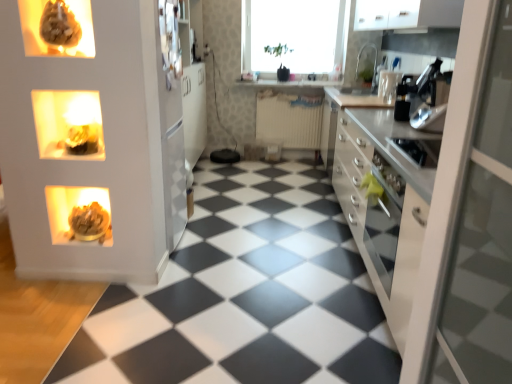
How much space does black plastic coffee maker at upper right, acting as the 3th appliance starting from the top, occupy vertically?

black plastic coffee maker at upper right, acting as the 3th appliance starting from the top, is 41.54 centimeters tall.

The image size is (512, 384). Describe the element at coordinates (245, 294) in the screenshot. I see `black rubber tile at center` at that location.

What is the approximate height of black rubber tile at center?

1.57 inches.

What is the approximate height of satin white countertop at right?

satin white countertop at right is 34.08 inches tall.

Locate an element on the screen. This screenshot has height=384, width=512. matte gold sculpture at left, the 3th appliance positioned from the back is located at coordinates (79, 215).

In order to click on matte gold candle at upper left in this screenshot , I will do `click(68, 124)`.

I want to click on matte brown sculpture at upper left, placed as the 1th appliance when sorted from front to back, so click(x=57, y=28).

You are a GUI agent. You are given a task and a screenshot of the screen. Output one action in this format:
    pyautogui.click(x=<x>, y=<y>)
    Task: Click on the clear glass cup at upper right, the 1th appliance in the right-to-left sequence
    The image size is (512, 384).
    Given the screenshot: What is the action you would take?
    pyautogui.click(x=388, y=86)

Identify the location of black plastic coffee maker at upper right, the 2th appliance when ordered from back to front. The width and height of the screenshot is (512, 384). tap(414, 89).

Can you see matte gold candle at upper left touching white matte cabinet at upper right?

No, matte gold candle at upper left is not touching white matte cabinet at upper right.

Is matte gold candle at upper left looking in the opposite direction of white matte cabinet at upper right?

No.

Does matte gold candle at upper left contain white matte cabinet at upper right?

No.

Between point (384, 20) and point (120, 286), which one is positioned in front?

The point (120, 286) is closer to the camera.

Considering the relative sizes of white matte cabinet at upper right and black rubber tile at center in the image provided, is white matte cabinet at upper right wider than black rubber tile at center?

No, white matte cabinet at upper right is not wider than black rubber tile at center.

At what (x,y) coordinates should I click in order to perform the action: click on tile beneath the white matte cabinet at upper right (from a real-world perspective). Please return your answer as a coordinate pair (x, y). This screenshot has width=512, height=384. Looking at the image, I should click on (245, 294).

Who is bigger, white matte cabinet at upper right or black rubber tile at center?

Bigger between the two is black rubber tile at center.

Is black rubber tile at center closer to camera compared to black plastic coffee maker at upper right, positioned as the 3th appliance in left-to-right order?

That is True.

How far apart are black rubber tile at center and black plastic coffee maker at upper right, acting as the 3th appliance starting from the top?

They are 4.47 feet apart.

Which of these two, black rubber tile at center or black plastic coffee maker at upper right, which is counted as the 2th appliance, starting from the bottom, is bigger?

Bigger between the two is black rubber tile at center.

Can you tell me how much white glossy countertop at center and matte brown sculpture at upper left, acting as the second appliance starting from the left, differ in facing direction?

0.0676 degrees.

Which is correct: white glossy countertop at center is inside matte brown sculpture at upper left, placed as the 4th appliance when sorted from back to front, or outside of it?

white glossy countertop at center is outside matte brown sculpture at upper left, placed as the 4th appliance when sorted from back to front.

Considering the relative sizes of white glossy countertop at center and matte brown sculpture at upper left, acting as the second appliance starting from the left, in the image provided, is white glossy countertop at center smaller than matte brown sculpture at upper left, acting as the second appliance starting from the left,?

Actually, white glossy countertop at center might be larger than matte brown sculpture at upper left, acting as the second appliance starting from the left.

From a real-world perspective, is matte gold candle at upper left positioned above or below white glossy countertop at center?

matte gold candle at upper left is situated higher than white glossy countertop at center in the real world.

Can you see matte gold candle at upper left touching white glossy countertop at center?

There is a gap between matte gold candle at upper left and white glossy countertop at center.

Consider the image. From the image's perspective, is matte gold candle at upper left above white glossy countertop at center?

Actually, matte gold candle at upper left appears below white glossy countertop at center in the image.

Does transparent glass window at upper center turn towards black rubber tile at center?

No.

Can you confirm if transparent glass window at upper center is positioned to the left of black rubber tile at center?

No.

Is transparent glass window at upper center far away from black rubber tile at center?

transparent glass window at upper center is positioned a significant distance from black rubber tile at center.

From a real-world perspective, does transparent glass window at upper center stand above black rubber tile at center?

Yes, from a real-world perspective, transparent glass window at upper center is over black rubber tile at center

Is point (326, 111) farther from camera compared to point (289, 58)?

No.

Is satin white countertop at right thinner than transparent glass window at upper center?

In fact, satin white countertop at right might be wider than transparent glass window at upper center.

Which object is positioned more to the right, satin white countertop at right or transparent glass window at upper center?

From the viewer's perspective, satin white countertop at right appears more on the right side.

From a real-world perspective, who is located higher, satin white countertop at right or transparent glass window at upper center?

transparent glass window at upper center is physically above.

Identify the location of shelf on the left of white matte cabinet at upper right. (68, 124).

The width and height of the screenshot is (512, 384). Find the location of `cabinetry lying above the black rubber tile at center (from the image's perspective)`. cabinetry lying above the black rubber tile at center (from the image's perspective) is located at coordinates (407, 14).

Estimate the real-world distances between objects in this image. Which object is closer to white glossy countertop at center, satin white countertop at right or white matte cabinet at upper right?

white matte cabinet at upper right.

Which object lies further to the anchor point satin white countertop at right, black rubber tile at center or transparent glass window at upper center?

transparent glass window at upper center is further to satin white countertop at right.

In the scene shown: Looking at the image, which one is located further to satin white countertop at right, black rubber tile at center or black plastic coffee maker at upper right, acting as the 3th appliance starting from the top?

black plastic coffee maker at upper right, acting as the 3th appliance starting from the top, is positioned further to the anchor satin white countertop at right.

Looking at the image, which one is located closer to white glossy countertop at center, matte brown sculpture at upper left, acting as the second appliance starting from the left, or transparent glass window at upper center?

Based on the image, transparent glass window at upper center appears to be nearer to white glossy countertop at center.

When comparing their distances from black plastic coffee maker at upper right, marked as the 3th appliance in a front-to-back arrangement, does white matte cabinet at upper right or white glossy countertop at center seem further?

Based on the image, white glossy countertop at center appears to be further to black plastic coffee maker at upper right, marked as the 3th appliance in a front-to-back arrangement.

Looking at this image, when comparing their distances from satin white countertop at right, does matte gold candle at upper left or white glossy countertop at center seem closer?

Based on the image, matte gold candle at upper left appears to be nearer to satin white countertop at right.

Which object lies nearer to the anchor point black rubber tile at center, satin white countertop at right or matte gold sculpture at left, positioned as the second appliance in front-to-back order?

satin white countertop at right lies closer to black rubber tile at center than the other object.

Which object lies nearer to the anchor point white matte cabinet at upper right, transparent glass window at upper center or matte brown sculpture at upper left, which is the third appliance in bottom-to-top order?

transparent glass window at upper center is closer to white matte cabinet at upper right.

Locate an element on the screen. The image size is (512, 384). countertop located between matte gold candle at upper left and clear glass cup at upper right, which is the 1th appliance in top-to-bottom order, in the left-right direction is located at coordinates (385, 197).

This screenshot has width=512, height=384. What are the coordinates of `tile between matte brown sculpture at upper left, which is the third appliance in bottom-to-top order, and satin white countertop at right from left to right` in the screenshot? It's located at (245, 294).

Image resolution: width=512 pixels, height=384 pixels. I want to click on tile between satin white countertop at right and clear glass cup at upper right, which is the 1th appliance in top-to-bottom order, from front to back, so click(x=245, y=294).

The width and height of the screenshot is (512, 384). What are the coordinates of `window between white matte cabinet at upper right and white glossy countertop at center along the z-axis` in the screenshot? It's located at (293, 35).